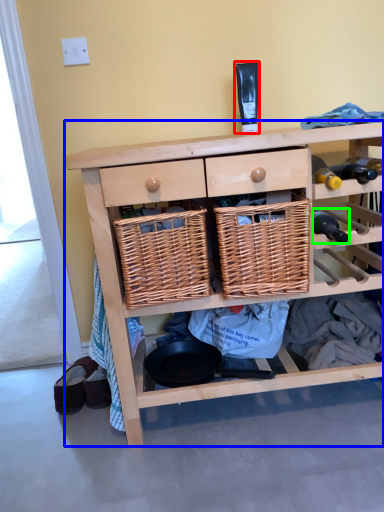
Question: Considering the real-world distances, which object is closest to toiletry (highlighted by a red box)? shelf (highlighted by a blue box) or bottle (highlighted by a green box).

Choices:
 (A) shelf
 (B) bottle

Answer: (B)